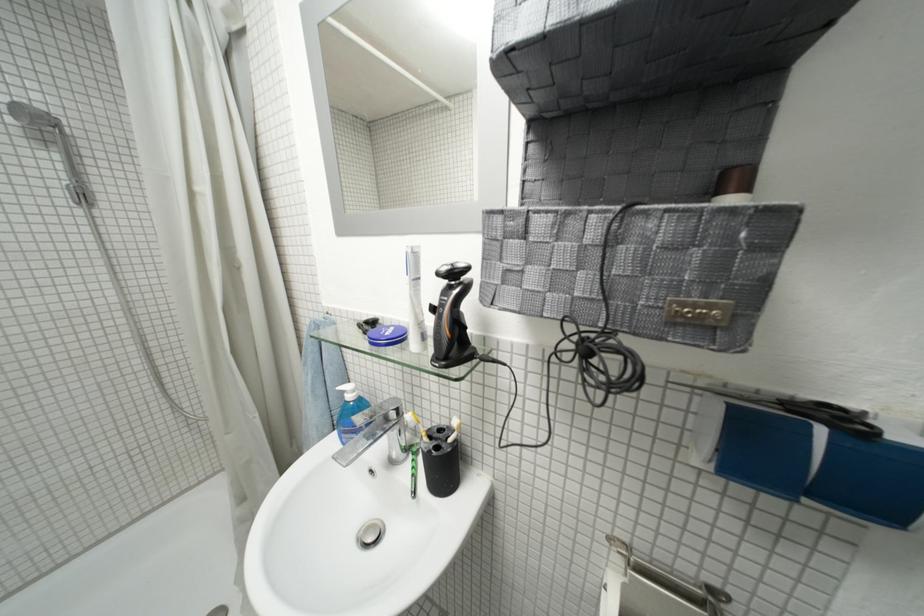
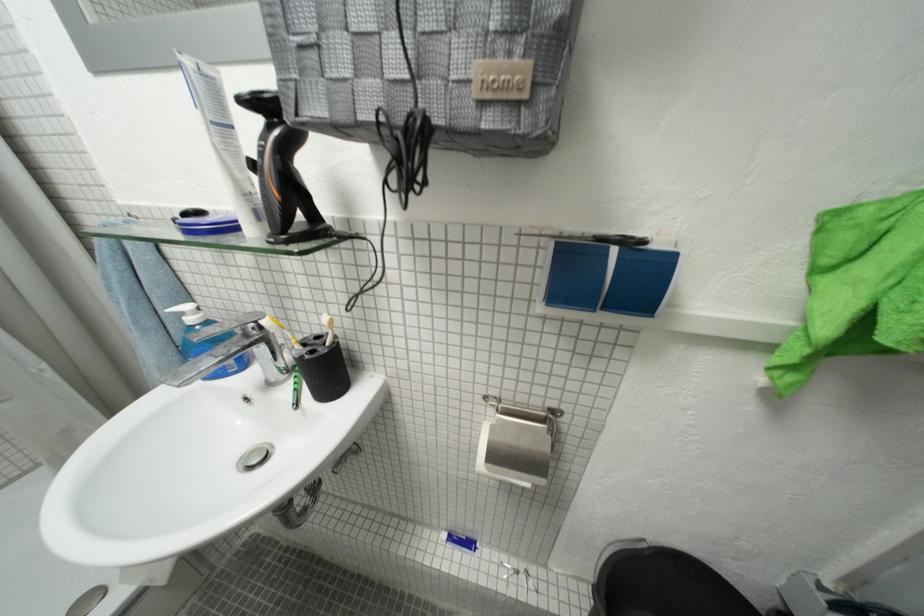
Where in the second image is the point corresponding to point (732, 326) from the first image?

(535, 98)